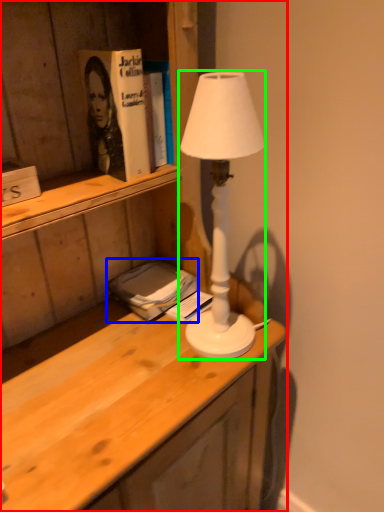
Question: Which object is the closest to the desk (highlighted by a red box)? Choose among these: book (highlighted by a blue box) or lamp (highlighted by a green box).

Choices:
 (A) book
 (B) lamp

Answer: (B)